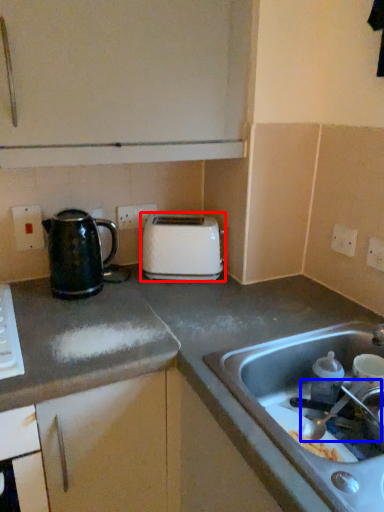
Question: Among these objects, which one is farthest to the camera, toaster (highlighted by a red box) or faucet (highlighted by a blue box)?

Choices:
 (A) toaster
 (B) faucet

Answer: (A)